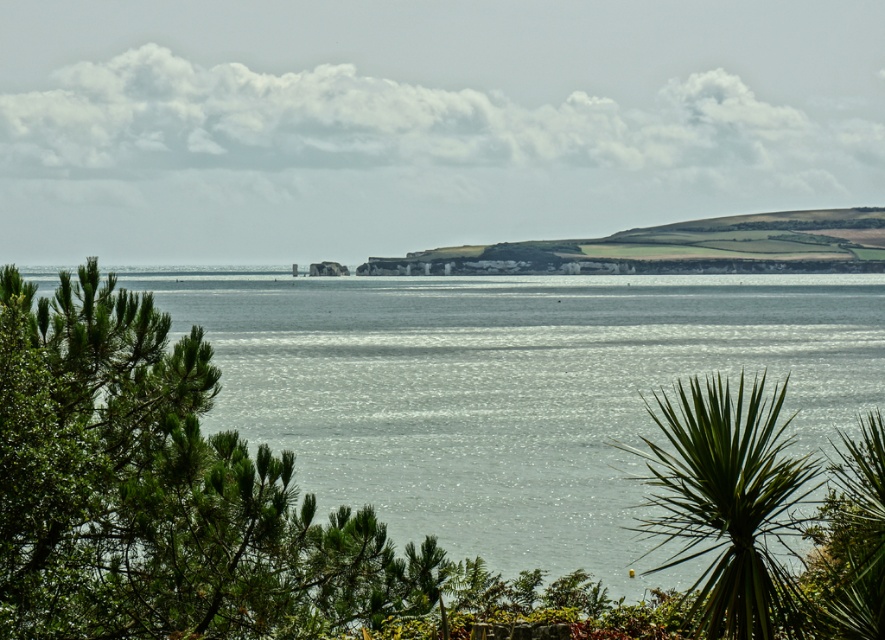
Question: Which point appears farthest from the camera in this image?

Choices:
 (A) (820, 257)
 (B) (556, 547)
 (C) (35, 544)

Answer: (A)

Question: Where is green leafy tree at center-left located in relation to green grassy hill at center in the image?

Choices:
 (A) above
 (B) below

Answer: (B)

Question: Which of the following is the closest to the observer?

Choices:
 (A) (653, 515)
 (B) (10, 460)

Answer: (A)

Question: Can you confirm if green leafy tree at center-left is positioned below green grassy hill at center?

Choices:
 (A) no
 (B) yes

Answer: (B)

Question: Is clear water at center smaller than green leafy tree at center-left?

Choices:
 (A) yes
 (B) no

Answer: (B)

Question: Which object is the closest to the green leafy tree at center-left?

Choices:
 (A) green leafy palm tree at lower right
 (B) clear water at center
 (C) green grassy hill at center

Answer: (A)